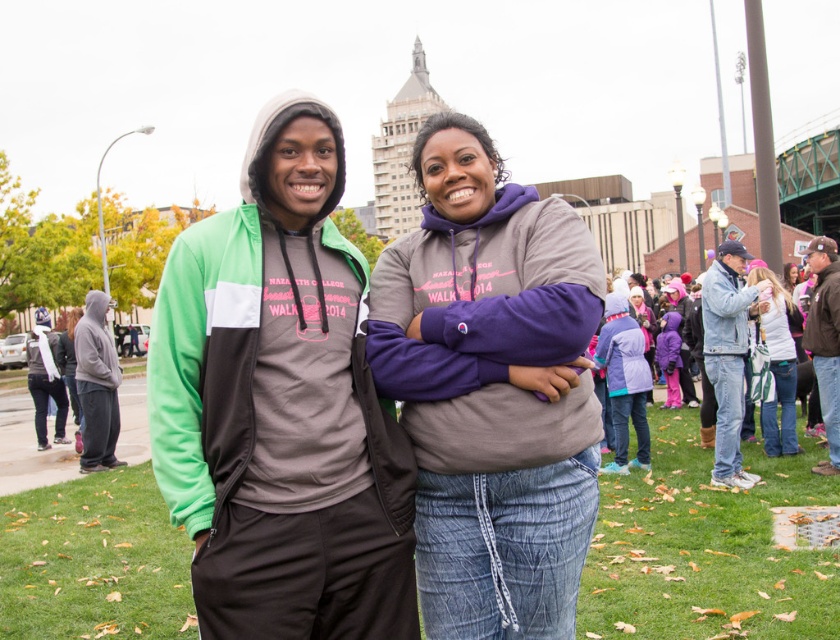
Question: Which object is positioned farthest from the purple fleece jacket at lower right?

Choices:
 (A) denim sweatshirt at right
 (B) matte gray hoodie at center
 (C) brown leather jacket at right
 (D) green grass at center

Answer: (B)

Question: Which of the following is the farthest from the observer?

Choices:
 (A) purple fleece jacket at lower right
 (B) denim jacket at lower right
 (C) green grass at center

Answer: (A)

Question: From the image, what is the correct spatial relationship of denim jacket at lower right in relation to white fleece jacket at right?

Choices:
 (A) above
 (B) below

Answer: (A)

Question: Can you confirm if brown leather jacket at right is positioned to the right of denim sweatshirt at right?

Choices:
 (A) no
 (B) yes

Answer: (B)

Question: Which object is farther from the camera taking this photo?

Choices:
 (A) white fleece jacket at right
 (B) gray fleece sweatshirt at left

Answer: (B)

Question: Is denim sweatshirt at right further to camera compared to gray fleece sweatshirt at left?

Choices:
 (A) no
 (B) yes

Answer: (A)